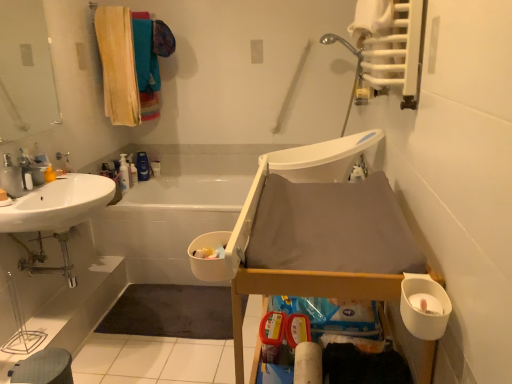
Question: Is brushed metal faucet at upper left shorter than gray fabric step stool at lower left?

Choices:
 (A) yes
 (B) no

Answer: (A)

Question: Can you see brushed metal faucet at upper left touching gray fabric step stool at lower left?

Choices:
 (A) no
 (B) yes

Answer: (A)

Question: Does brushed metal faucet at upper left have a smaller size compared to gray fabric step stool at lower left?

Choices:
 (A) no
 (B) yes

Answer: (B)

Question: From a real-world perspective, is brushed metal faucet at upper left below gray fabric step stool at lower left?

Choices:
 (A) no
 (B) yes

Answer: (A)

Question: Does brushed metal faucet at upper left turn towards gray fabric step stool at lower left?

Choices:
 (A) no
 (B) yes

Answer: (A)

Question: Does brushed metal faucet at upper left appear on the right side of gray fabric step stool at lower left?

Choices:
 (A) yes
 (B) no

Answer: (B)

Question: From a real-world perspective, is translucent plastic bottle at upper center, which is the first toiletry from back to front, positioned under matte silver faucet at left based on gravity?

Choices:
 (A) no
 (B) yes

Answer: (B)

Question: Is translucent plastic bottle at upper center, which is the first toiletry from back to front, wider than matte silver faucet at left?

Choices:
 (A) no
 (B) yes

Answer: (A)

Question: Is translucent plastic bottle at upper center, which is the first toiletry from back to front, smaller than matte silver faucet at left?

Choices:
 (A) yes
 (B) no

Answer: (A)

Question: From the image's perspective, is translucent plastic bottle at upper center, which is the first toiletry from back to front, on top of matte silver faucet at left?

Choices:
 (A) yes
 (B) no

Answer: (A)

Question: Is translucent plastic bottle at upper center, which is the first toiletry from back to front, beside matte silver faucet at left?

Choices:
 (A) yes
 (B) no

Answer: (B)

Question: Considering the relative sizes of translucent plastic bottle at upper center, marked as the 2th toiletry in a front-to-back arrangement, and matte silver faucet at left in the image provided, is translucent plastic bottle at upper center, marked as the 2th toiletry in a front-to-back arrangement, thinner than matte silver faucet at left?

Choices:
 (A) yes
 (B) no

Answer: (A)

Question: Is soft yellow towel at upper left at the left side of gray fabric step stool at lower left?

Choices:
 (A) yes
 (B) no

Answer: (B)